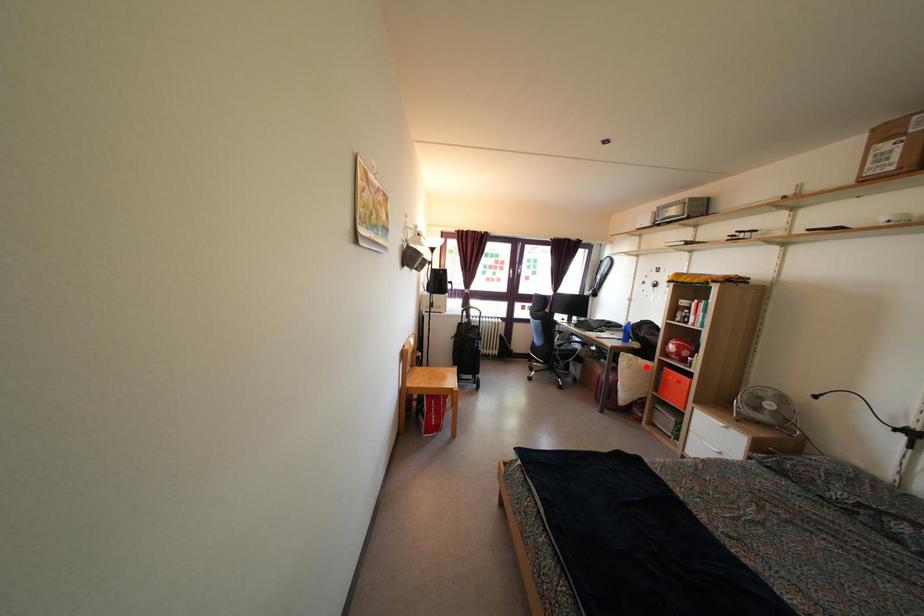
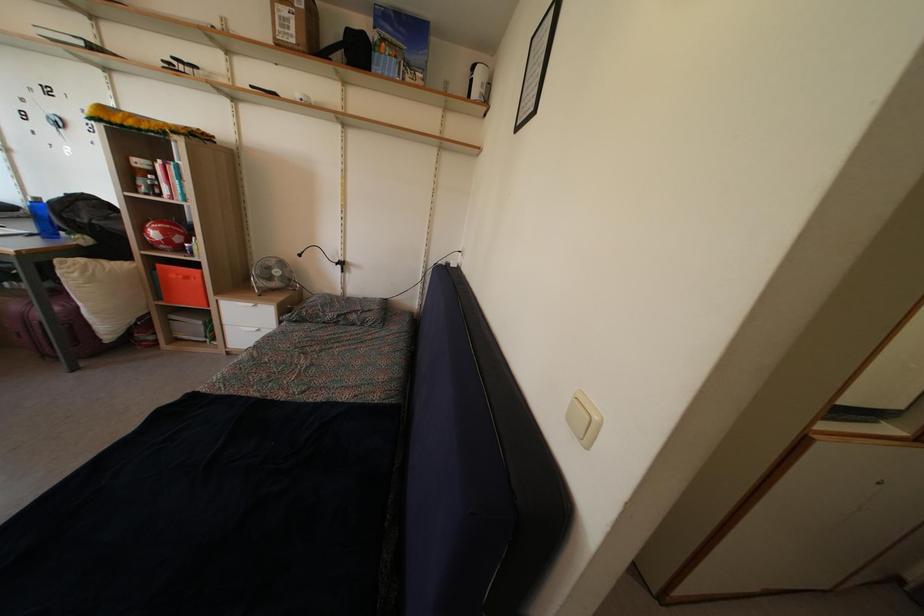
In the second image, find the point that corresponds to the highlighted location in the first image.

(116, 268)